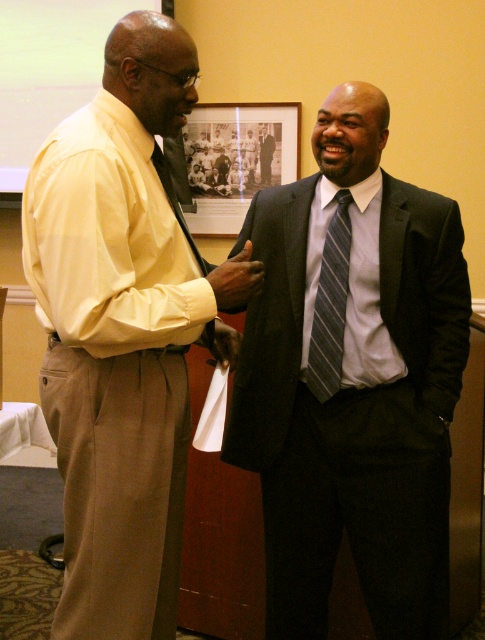
Question: Does matte yellow shirt at left have a smaller size compared to matte black glove at center?

Choices:
 (A) yes
 (B) no

Answer: (B)

Question: Which object is closer to the camera taking this photo?

Choices:
 (A) matte black glove at center
 (B) dark gray suit at center

Answer: (A)

Question: Does matte yellow shirt at left appear on the left side of matte black phone at center?

Choices:
 (A) yes
 (B) no

Answer: (A)

Question: Which object is positioned closest to the dark gray suit at center?

Choices:
 (A) striped fabric tie at center
 (B) matte yellow shirt at left
 (C) light blue cotton dress shirt at center
 (D) matte black glove at center

Answer: (C)

Question: Which point is closer to the camera?

Choices:
 (A) (248, 269)
 (B) (419, 515)
 (C) (337, 189)
 (D) (223, 362)

Answer: (A)

Question: Is the position of matte black phone at center more distant than that of matte black glove at center?

Choices:
 (A) yes
 (B) no

Answer: (B)